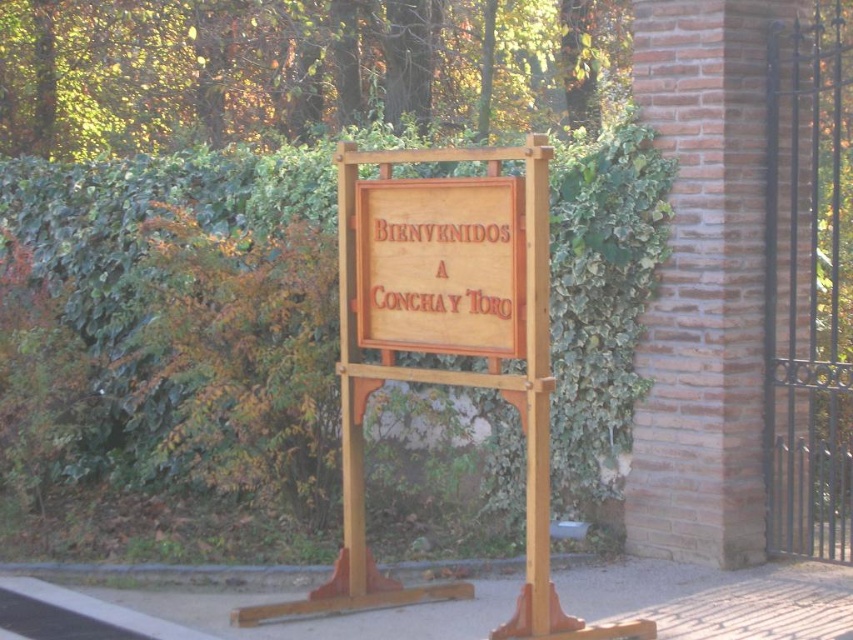
Question: Is green ivy hedge at center wider than wooden sign at center?

Choices:
 (A) no
 (B) yes

Answer: (B)

Question: Which object is closer to the camera taking this photo?

Choices:
 (A) green ivy hedge at center
 (B) wooden sign at center

Answer: (B)

Question: Which point is closer to the camera taking this photo?

Choices:
 (A) (496, 180)
 (B) (650, 291)

Answer: (A)

Question: Is green ivy hedge at center in front of wooden sign at center?

Choices:
 (A) yes
 (B) no

Answer: (B)

Question: Can you confirm if green ivy hedge at center is positioned below wooden sign at center?

Choices:
 (A) no
 (B) yes

Answer: (B)